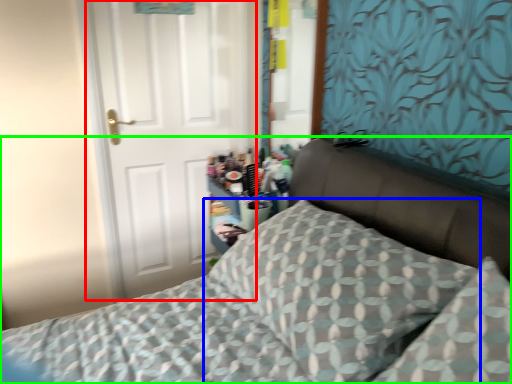
Question: Based on their relative distances, which object is nearer to door (highlighted by a red box)? Choose from pillow (highlighted by a blue box) and bed (highlighted by a green box).

Choices:
 (A) pillow
 (B) bed

Answer: (B)